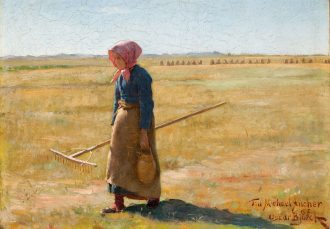
Locate an element on the screen. The image size is (330, 229). artwork is located at coordinates (283, 122).